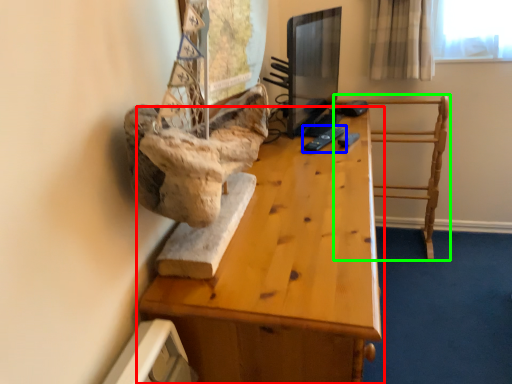
Question: Estimate the real-world distances between objects in this image. Which object is closer to table (highlighted by a red box), remote (highlighted by a blue box) or furniture (highlighted by a green box)?

Choices:
 (A) remote
 (B) furniture

Answer: (A)